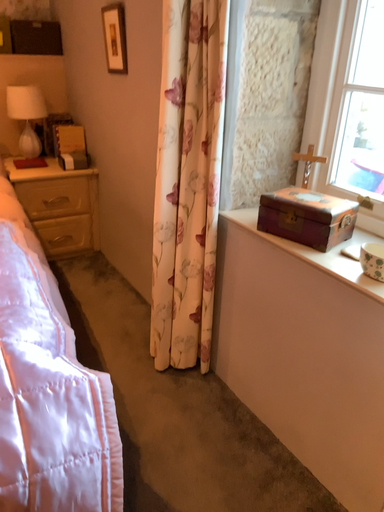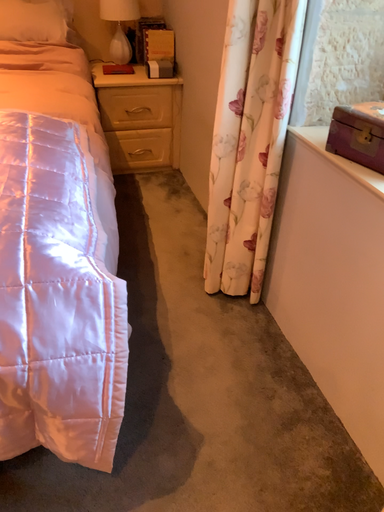
Question: Which way did the camera rotate in the video?

Choices:
 (A) rotated upward
 (B) rotated downward

Answer: (B)